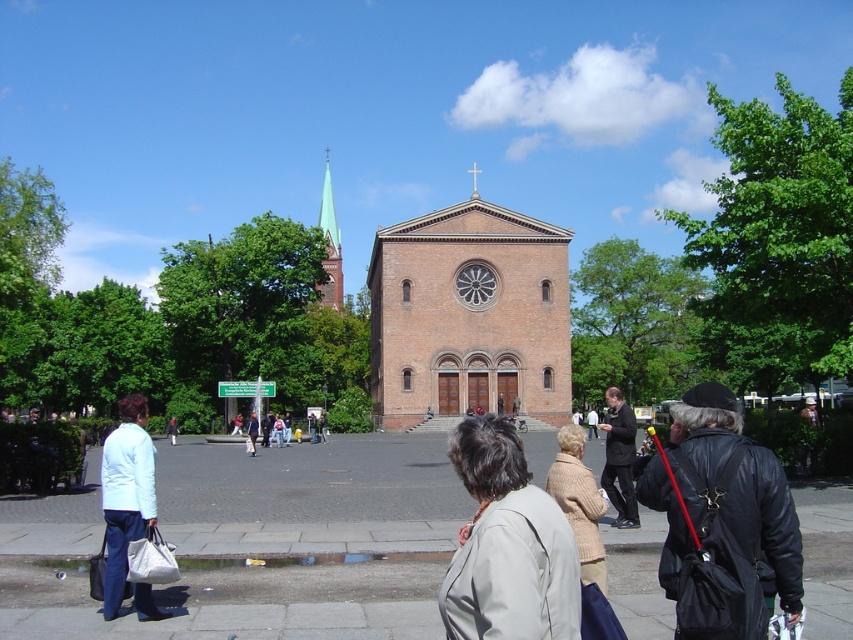
Question: Among these points, which one is nearest to the camera?

Choices:
 (A) (383, 273)
 (B) (102, 502)
 (C) (750, 538)

Answer: (C)

Question: Which point appears closest to the camera in this image?

Choices:
 (A) (456, 593)
 (B) (131, 440)
 (C) (757, 636)

Answer: (A)

Question: Can you confirm if black leather jacket at lower right is smaller than light beige jacket at lower center?

Choices:
 (A) yes
 (B) no

Answer: (A)

Question: Does light blue fabric jacket at lower left appear on the left side of green glass steeple at upper center?

Choices:
 (A) yes
 (B) no

Answer: (A)

Question: Which of the following is the farthest from the observer?

Choices:
 (A) (624, 470)
 (B) (512, 321)
 (C) (109, 577)
 (D) (332, 307)

Answer: (D)

Question: Is light beige jacket at lower center wider than dark brown leather jacket at center?

Choices:
 (A) yes
 (B) no

Answer: (A)